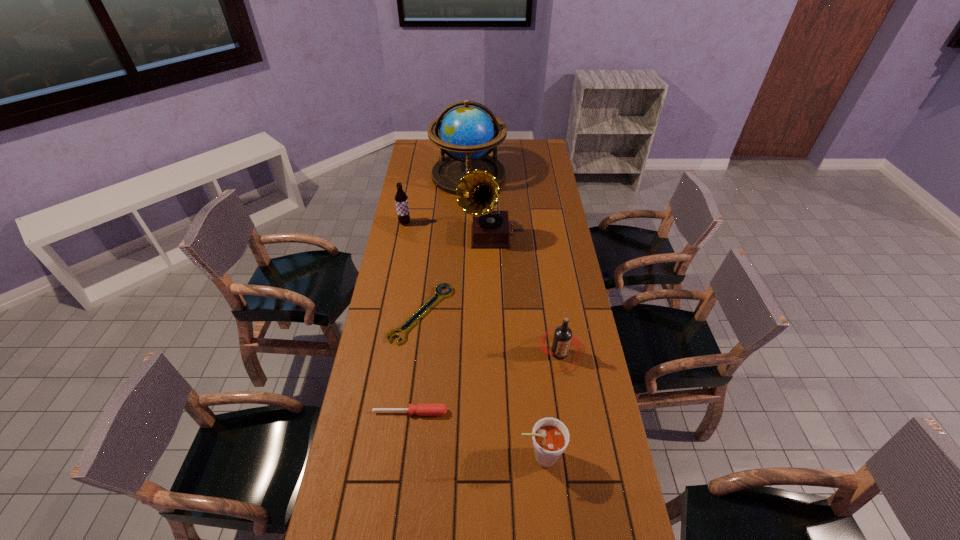
The image size is (960, 540). Find the location of `the tallest object`. the tallest object is located at coordinates (467, 134).

Where is `globe`? Image resolution: width=960 pixels, height=540 pixels. globe is located at coordinates (467, 134).

The image size is (960, 540). I want to click on the sixth shortest object, so click(478, 191).

This screenshot has height=540, width=960. Find the location of `the farthest root beer`. the farthest root beer is located at coordinates (401, 199).

Where is `the second nearest root beer`? the second nearest root beer is located at coordinates (563, 336).

You are a GUI agent. You are given a task and a screenshot of the screen. Output one action in this format:
    pyautogui.click(x=<x>, y=<y>)
    Task: Click on the nearest object
    This screenshot has width=960, height=540.
    Given the screenshot: What is the action you would take?
    pyautogui.click(x=550, y=437)

Where is `the sixth tallest object`? the sixth tallest object is located at coordinates (421, 409).

You are a GUI agent. You are given a task and a screenshot of the screen. Output one action in this format:
    pyautogui.click(x=<x>, y=<y>)
    Task: Click on the screwdriver
    The width and height of the screenshot is (960, 540).
    Given the screenshot: What is the action you would take?
    pyautogui.click(x=421, y=409)

At what (x,y) coordinates should I click in order to perform the action: click on the shortest object. Please return your answer as a coordinate pair (x, y). Image resolution: width=960 pixels, height=540 pixels. Looking at the image, I should click on (430, 303).

Locate an element on the screen. The width and height of the screenshot is (960, 540). vacant space situated 0.380m on the front of the globe is located at coordinates (466, 247).